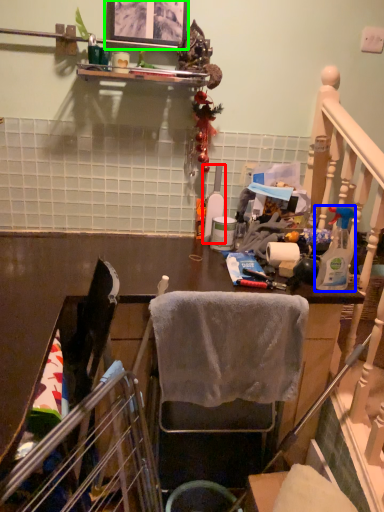
Question: Which is nearer to the bottle (highlighted by a red box)? bottle (highlighted by a blue box) or picture frame (highlighted by a green box).

Choices:
 (A) bottle
 (B) picture frame

Answer: (A)